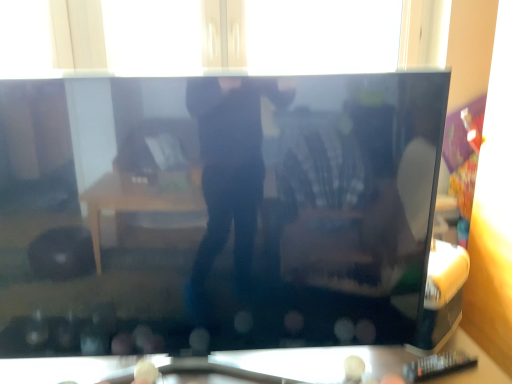
This screenshot has width=512, height=384. What do you see at coordinates (219, 213) in the screenshot?
I see `black glossy television at center` at bounding box center [219, 213].

Where is `transparent glass window at upper center`? The height and width of the screenshot is (384, 512). transparent glass window at upper center is located at coordinates (322, 36).

From the image's perspective, is transparent glass table at lower center above black glossy television at center?

No.

Where is `furniture lying behind the black glossy television at center`? The image size is (512, 384). furniture lying behind the black glossy television at center is located at coordinates (316, 361).

From the picture: Which is more to the right, transparent glass table at lower center or black glossy television at center?

Positioned to the right is transparent glass table at lower center.

Are black glossy television at center and transparent glass table at lower center beside each other?

black glossy television at center and transparent glass table at lower center are clearly separated.

Can you tell me how much black glossy television at center and transparent glass table at lower center differ in facing direction?

The facing directions of black glossy television at center and transparent glass table at lower center are 3.93 degrees apart.

Based on the photo, from the image's perspective, is black glossy television at center on transparent glass table at lower center?

Yes.

Can you confirm if black glossy television at center is thinner than transparent glass table at lower center?

Incorrect, the width of black glossy television at center is not less than that of transparent glass table at lower center.

Is transparent glass table at lower center oriented towards transparent glass window at upper center?

No.

Can you confirm if transparent glass table at lower center is smaller than transparent glass window at upper center?

Actually, transparent glass table at lower center might be larger than transparent glass window at upper center.

Which object is positioned more to the left, transparent glass table at lower center or transparent glass window at upper center?

From the viewer's perspective, transparent glass table at lower center appears more on the left side.

From a real-world perspective, is transparent glass table at lower center physically below transparent glass window at upper center?

Yes, from a real-world perspective, transparent glass table at lower center is below transparent glass window at upper center.

Can you confirm if transparent glass window at upper center is smaller than black glossy television at center?

Yes.

From a real-world perspective, is transparent glass window at upper center below black glossy television at center?

No, from a real-world perspective, transparent glass window at upper center is not under black glossy television at center.

In the scene shown: How many degrees apart are the facing directions of transparent glass window at upper center and black glossy television at center?

5.74 degrees.

Which is more to the right, transparent glass window at upper center or black glossy television at center?

From the viewer's perspective, transparent glass window at upper center appears more on the right side.

Is transparent glass window at upper center wider than transparent glass table at lower center?

Incorrect, the width of transparent glass window at upper center does not surpass that of transparent glass table at lower center.

Which object is positioned more to the left, transparent glass window at upper center or transparent glass table at lower center?

transparent glass table at lower center is more to the left.

Is transparent glass table at lower center completely or partially inside transparent glass window at upper center?

No, transparent glass table at lower center is not inside transparent glass window at upper center.

Looking at this image, is transparent glass window at upper center far away from transparent glass table at lower center?

Indeed, transparent glass window at upper center is not near transparent glass table at lower center.

Considering the sizes of objects black glossy television at center and transparent glass window at upper center in the image provided, who is thinner, black glossy television at center or transparent glass window at upper center?

transparent glass window at upper center is thinner.

Considering the sizes of objects black glossy television at center and transparent glass window at upper center in the image provided, who is shorter, black glossy television at center or transparent glass window at upper center?

With less height is transparent glass window at upper center.

Choose the correct answer: Is black glossy television at center inside transparent glass window at upper center or outside it?

black glossy television at center cannot be found inside transparent glass window at upper center.

Which object is more forward, black glossy television at center or transparent glass window at upper center?

black glossy television at center is in front.

This screenshot has width=512, height=384. What are the coordinates of `television that appears above the transparent glass table at lower center (from the image's perspective)` in the screenshot? It's located at (219, 213).

At what (x,y) coordinates should I click in order to perform the action: click on furniture behind the black glossy television at center. Please return your answer as a coordinate pair (x, y). The width and height of the screenshot is (512, 384). Looking at the image, I should click on (316, 361).

Estimate the real-world distances between objects in this image. Which object is closer to transparent glass window at upper center, transparent glass table at lower center or black glossy television at center?

black glossy television at center.

Based on their spatial positions, is transparent glass window at upper center or black glossy television at center further from transparent glass table at lower center?

Among the two, transparent glass window at upper center is located further to transparent glass table at lower center.

Estimate the real-world distances between objects in this image. Which object is closer to black glossy television at center, transparent glass table at lower center or transparent glass window at upper center?

Based on the image, transparent glass table at lower center appears to be nearer to black glossy television at center.

Looking at the image, which one is located further to black glossy television at center, transparent glass window at upper center or transparent glass table at lower center?

transparent glass window at upper center is positioned further to the anchor black glossy television at center.

When comparing their distances from transparent glass window at upper center, does black glossy television at center or transparent glass table at lower center seem further?

transparent glass table at lower center is positioned further to the anchor transparent glass window at upper center.

Based on their spatial positions, is black glossy television at center or transparent glass window at upper center further from transparent glass table at lower center?

transparent glass window at upper center.

Where is `television between transparent glass window at upper center and transparent glass table at lower center vertically`? television between transparent glass window at upper center and transparent glass table at lower center vertically is located at coordinates (219, 213).